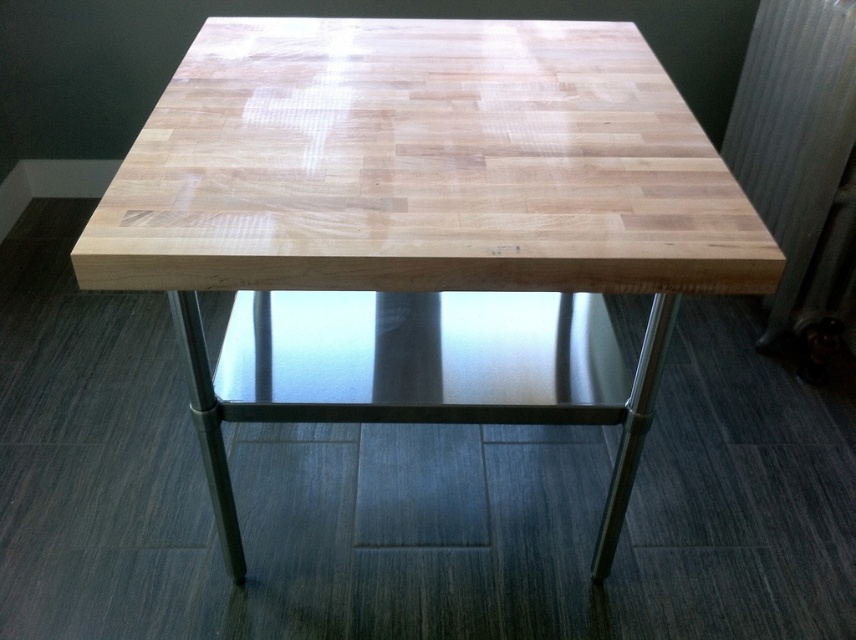
Does metallic silver stool at center have a lesser width compared to metallic silver radiator at right?

No, metallic silver stool at center is not thinner than metallic silver radiator at right.

Who is more forward, (x=340, y=358) or (x=758, y=28)?

Point (x=340, y=358)

Who is more forward, (290, 413) or (843, 125)?

Point (290, 413) is more forward.

At what (x,y) coordinates should I click in order to perform the action: click on metallic silver stool at center. Please return your answer as a coordinate pair (x, y). This screenshot has height=640, width=856. Looking at the image, I should click on (419, 358).

Is point (673, 212) farther from viewer compared to point (314, 387)?

No, (673, 212) is in front of (314, 387).

Can you confirm if natural wood table at center is bigger than metallic silver stool at center?

Yes.

Who is more forward, [308,257] or [257,396]?

Point [308,257] is more forward.

I want to click on natural wood table at center, so click(x=420, y=218).

Can you confirm if natural wood table at center is positioned to the right of metallic silver radiator at right?

Incorrect, natural wood table at center is not on the right side of metallic silver radiator at right.

Can you confirm if natural wood table at center is positioned above metallic silver radiator at right?

Actually, natural wood table at center is below metallic silver radiator at right.

Where is `natural wood table at center`? The height and width of the screenshot is (640, 856). natural wood table at center is located at coordinates (420, 218).